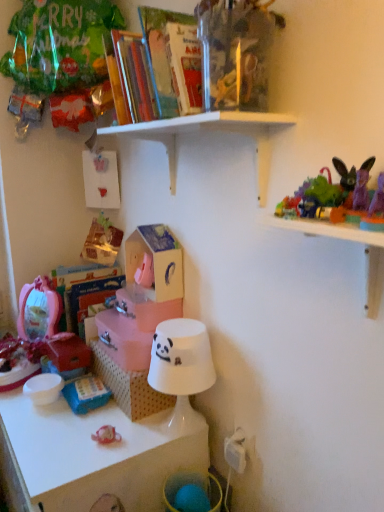
Image resolution: width=384 pixels, height=512 pixels. I want to click on blank space situated above white matte lampshade at center (from a real-world perspective), so click(179, 326).